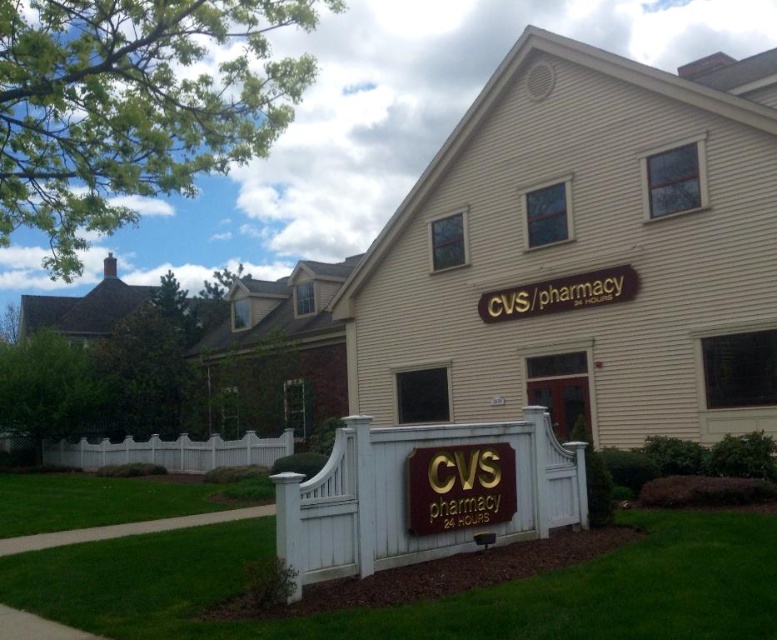
Question: Which point is farther to the camera?

Choices:
 (A) (420, 518)
 (B) (570, 470)

Answer: (B)

Question: Among these objects, which one is nearest to the camera?

Choices:
 (A) white picket fence at lower left
 (B) white wood fence at center

Answer: (B)

Question: In this image, where is gold metallic cvs pharmacy sign at center located relative to white picket fence at lower left?

Choices:
 (A) above
 (B) below

Answer: (A)

Question: Is white wood fence at center wider than white picket fence at lower left?

Choices:
 (A) yes
 (B) no

Answer: (B)

Question: Which point is farther to the camera?

Choices:
 (A) white picket fence at lower left
 (B) white wood fence at center
 (C) gold metallic cvs pharmacy sign at center

Answer: (A)

Question: Is gold metallic cvs pharmacy sign at center bigger than white picket fence at lower left?

Choices:
 (A) yes
 (B) no

Answer: (B)